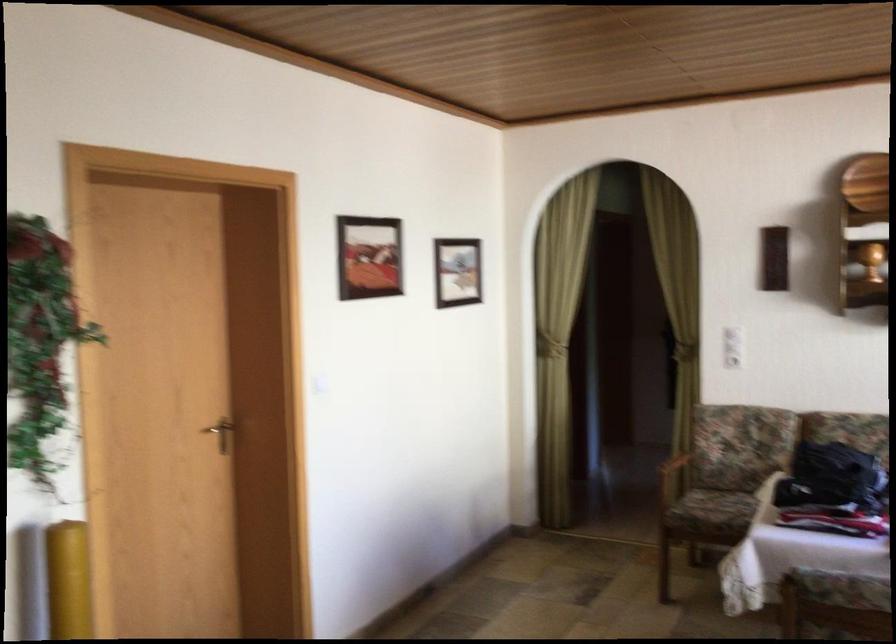
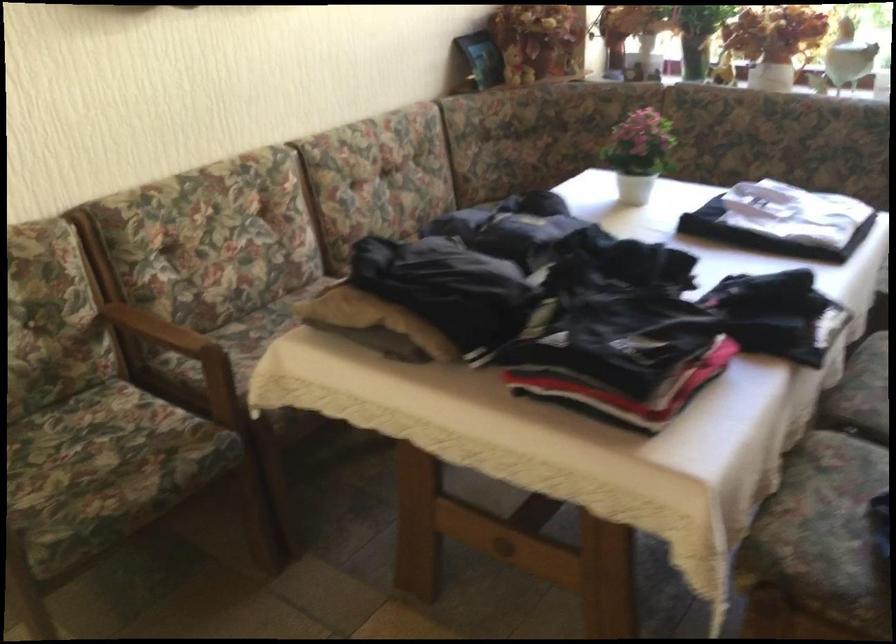
The point at (728, 496) is marked in the first image. Where is the corresponding point in the second image?

(67, 444)